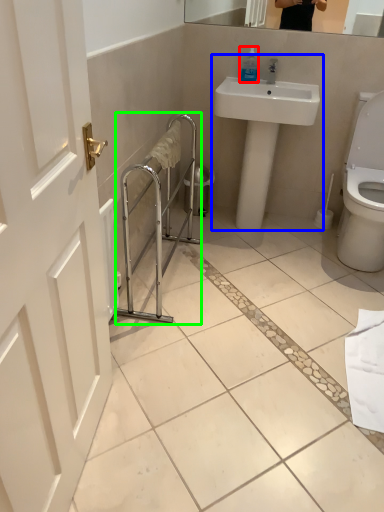
Question: Estimate the real-world distances between objects in this image. Which object is closer to soap dispenser (highlighted by a red box), sink (highlighted by a blue box) or balustrade (highlighted by a green box)?

Choices:
 (A) sink
 (B) balustrade

Answer: (A)